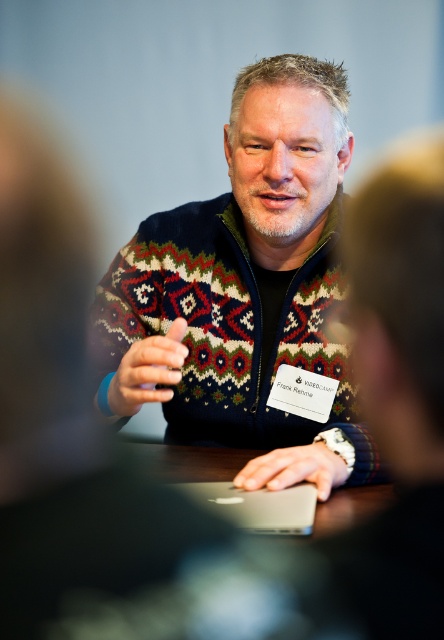
Can you confirm if knitted sweater at center is taller than matte black hand at center?

Yes, knitted sweater at center is taller than matte black hand at center.

Is knitted sweater at center above matte black hand at center?

Correct, knitted sweater at center is located above matte black hand at center.

Between point (265, 237) and point (166, 388), which one is positioned in front?

Point (166, 388) is more forward.

The image size is (444, 640). Find the location of `knitted sweater at center`. knitted sweater at center is located at coordinates (241, 280).

Can you confirm if matte black hand at center is wider than satin silver mouse at center?

In fact, matte black hand at center might be narrower than satin silver mouse at center.

Which is behind, point (154, 394) or point (286, 458)?

Positioned behind is point (286, 458).

You are a GUI agent. You are given a task and a screenshot of the screen. Output one action in this format:
    pyautogui.click(x=<x>, y=<y>)
    Task: Click on the matte black hand at center
    The height and width of the screenshot is (640, 444).
    Given the screenshot: What is the action you would take?
    pyautogui.click(x=147, y=371)

Can you confirm if silver metallic laptop at center is positioned below matte black hand at center?

Yes, silver metallic laptop at center is below matte black hand at center.

Which is in front, point (201, 484) or point (138, 349)?

Point (138, 349) is more forward.

Is point (170, 449) behind point (146, 390)?

Yes, it is behind point (146, 390).

You are a GUI agent. You are given a task and a screenshot of the screen. Output one action in this format:
    pyautogui.click(x=<x>, y=<y>)
    Task: Click on the silver metallic laptop at center
    
    Given the screenshot: What is the action you would take?
    pyautogui.click(x=198, y=468)